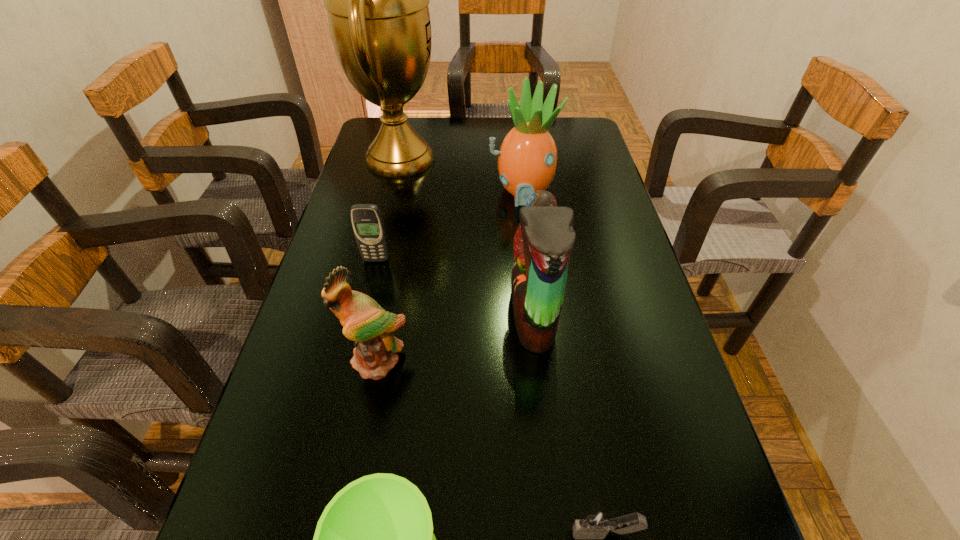
Where is `vacant area situated on the front-facing side of the left parrot`? The image size is (960, 540). vacant area situated on the front-facing side of the left parrot is located at coordinates (346, 522).

The width and height of the screenshot is (960, 540). What are the coordinates of `free space located 0.210m on the screen of the third farthest object` in the screenshot? It's located at (359, 331).

Locate an element on the screen. object present at the far edge is located at coordinates (377, 0).

The height and width of the screenshot is (540, 960). Identify the location of trophy cup situated at the left edge. (377, 0).

Locate an element on the screen. The width and height of the screenshot is (960, 540). parrot at the left edge is located at coordinates (365, 322).

You are a GUI agent. You are given a task and a screenshot of the screen. Output one action in this format:
    pyautogui.click(x=<x>, y=<y>)
    Task: Click on the cellular telephone present at the left edge
    This screenshot has height=540, width=960.
    Given the screenshot: What is the action you would take?
    pyautogui.click(x=366, y=219)

Where is `object present at the far left corner`? The height and width of the screenshot is (540, 960). object present at the far left corner is located at coordinates 377,0.

You are a GUI agent. You are given a task and a screenshot of the screen. Output one action in this format:
    pyautogui.click(x=<x>, y=<y>)
    Task: Click on the free point at the far edge
    
    Given the screenshot: What is the action you would take?
    pyautogui.click(x=485, y=141)

Find the location of a particular element. The width and height of the screenshot is (960, 540). blank space at the left edge of the desktop is located at coordinates (352, 187).

In the image, there is a desktop. In order to click on vacant space at the right edge in this screenshot , I will do `click(588, 249)`.